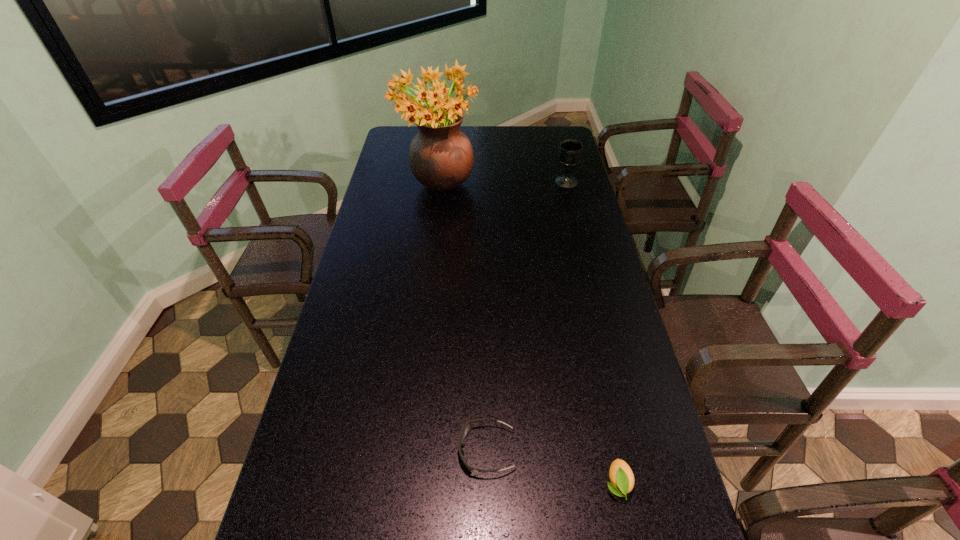
Where is `chalice present at the right edge`? The height and width of the screenshot is (540, 960). chalice present at the right edge is located at coordinates (570, 151).

Locate an element on the screen. The width and height of the screenshot is (960, 540). lemon situated at the right edge is located at coordinates (621, 476).

In the image, there is a desktop. What are the coordinates of `vacant space at the far edge` in the screenshot? It's located at pyautogui.click(x=502, y=129).

You are a GUI agent. You are given a task and a screenshot of the screen. Output one action in this format:
    pyautogui.click(x=<x>, y=<y>)
    Task: Click on the vacant region at the left edge of the desktop
    
    Given the screenshot: What is the action you would take?
    pyautogui.click(x=362, y=313)

The width and height of the screenshot is (960, 540). What are the coordinates of `free space at the right edge of the desktop` in the screenshot? It's located at (577, 235).

Where is `free space at the far left corner of the desktop`? free space at the far left corner of the desktop is located at coordinates tap(419, 132).

Identify the location of free point between the chalice and the shortest object. The height and width of the screenshot is (540, 960). (526, 316).

Where is `vacant area between the shortest object and the tallest object`? The height and width of the screenshot is (540, 960). vacant area between the shortest object and the tallest object is located at coordinates (463, 320).

The image size is (960, 540). I want to click on vacant area that lies between the goggles and the flower arrangement, so click(463, 320).

The image size is (960, 540). I want to click on free space between the shortest object and the third tallest object, so click(x=552, y=467).